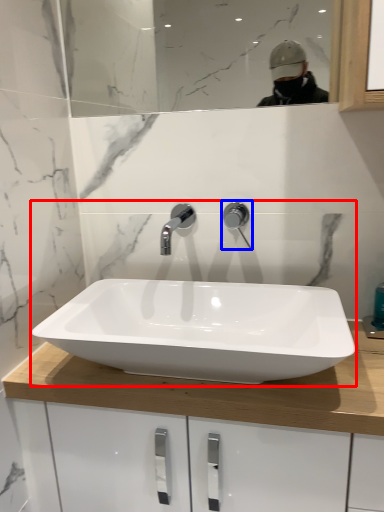
Question: Which point is further to the camera, sink (highlighted by a red box) or tap (highlighted by a blue box)?

Choices:
 (A) sink
 (B) tap

Answer: (B)